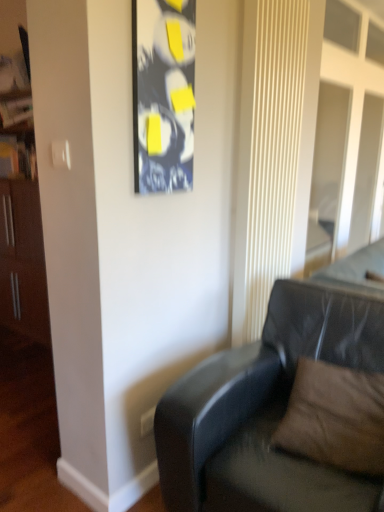
Question: Can you confirm if black glossy picture frame at upper center is bigger than black leather couch at lower right?

Choices:
 (A) yes
 (B) no

Answer: (B)

Question: Can you confirm if black glossy picture frame at upper center is positioned to the left of black leather couch at lower right?

Choices:
 (A) no
 (B) yes

Answer: (B)

Question: Does black glossy picture frame at upper center turn towards black leather couch at lower right?

Choices:
 (A) no
 (B) yes

Answer: (A)

Question: Does black glossy picture frame at upper center have a greater height compared to black leather couch at lower right?

Choices:
 (A) yes
 (B) no

Answer: (B)

Question: Does black glossy picture frame at upper center have a lesser height compared to black leather couch at lower right?

Choices:
 (A) yes
 (B) no

Answer: (A)

Question: Considering the relative positions of black leather couch at lower right and black glossy picture frame at upper center in the image provided, is black leather couch at lower right to the left or to the right of black glossy picture frame at upper center?

Choices:
 (A) right
 (B) left

Answer: (A)

Question: Considering their positions, is black leather couch at lower right located in front of or behind black glossy picture frame at upper center?

Choices:
 (A) behind
 (B) front

Answer: (B)

Question: Considering the positions of black leather couch at lower right and black glossy picture frame at upper center in the image, is black leather couch at lower right taller or shorter than black glossy picture frame at upper center?

Choices:
 (A) tall
 (B) short

Answer: (A)

Question: Is black leather couch at lower right wider or thinner than black glossy picture frame at upper center?

Choices:
 (A) thin
 (B) wide

Answer: (B)

Question: Visually, is black glossy picture frame at upper center positioned to the left or to the right of black leather couch at lower right?

Choices:
 (A) left
 (B) right

Answer: (A)

Question: Looking at their shapes, would you say black glossy picture frame at upper center is wider or thinner than black leather couch at lower right?

Choices:
 (A) wide
 (B) thin

Answer: (B)

Question: From the image's perspective, is black glossy picture frame at upper center above or below black leather couch at lower right?

Choices:
 (A) above
 (B) below

Answer: (A)

Question: Based on their sizes in the image, would you say black glossy picture frame at upper center is bigger or smaller than black leather couch at lower right?

Choices:
 (A) big
 (B) small

Answer: (B)

Question: Is brown suede pillow at lower right taller or shorter than black glossy picture frame at upper center?

Choices:
 (A) short
 (B) tall

Answer: (A)

Question: In terms of size, does brown suede pillow at lower right appear bigger or smaller than black glossy picture frame at upper center?

Choices:
 (A) big
 (B) small

Answer: (A)